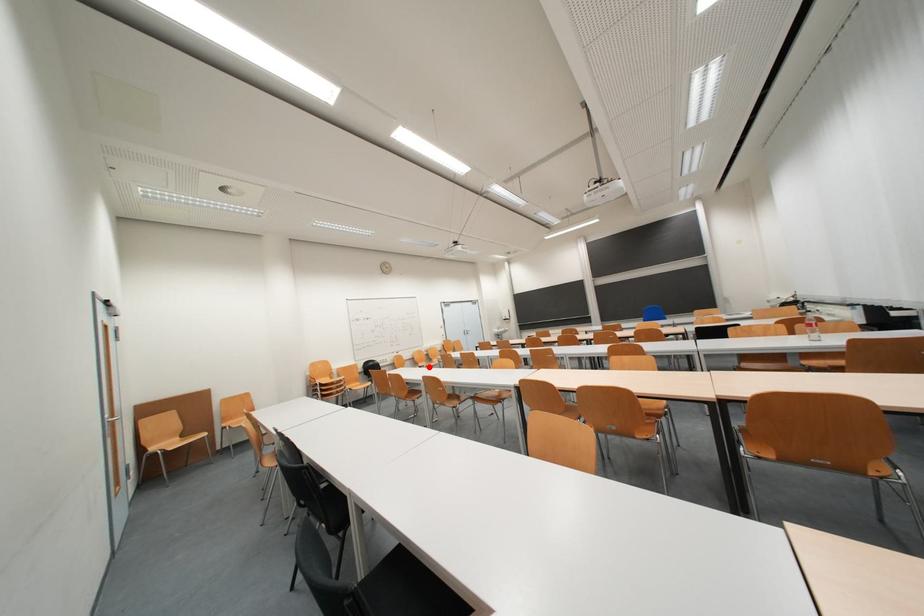
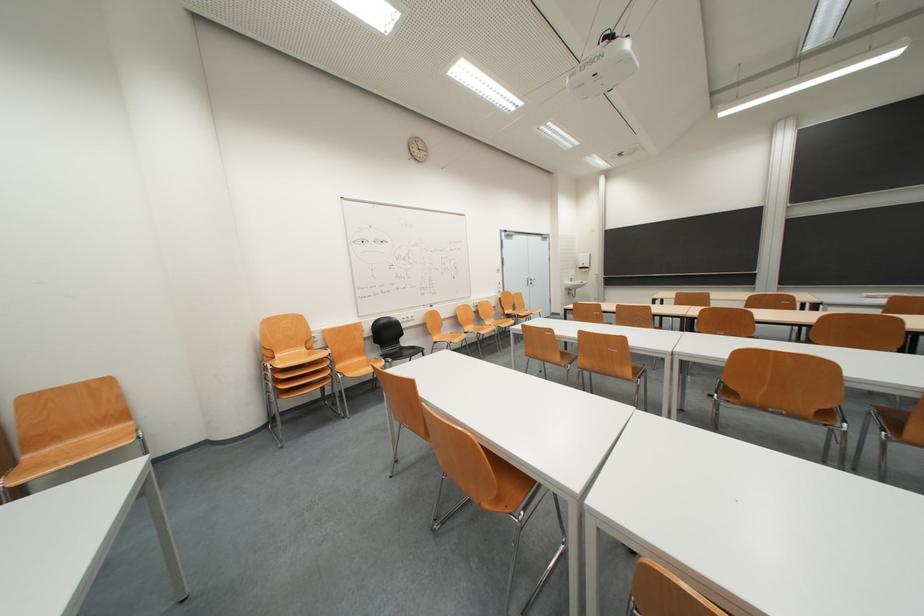
The point at the highlighted location is marked in the first image. Where is the corresponding point in the second image?

(476, 328)